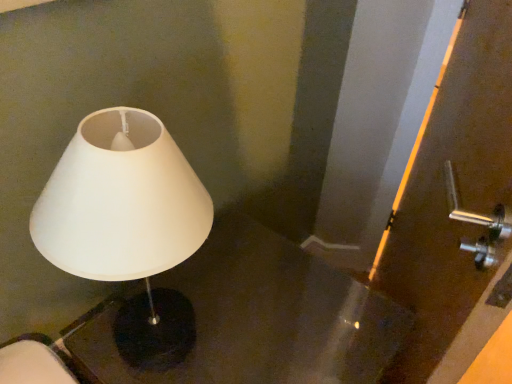
The width and height of the screenshot is (512, 384). Identify the location of free space above black glossy table at left (from a real-world perspective). (227, 322).